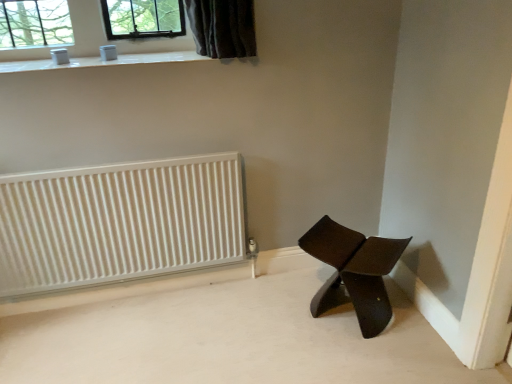
Question: From the image's perspective, is white glossy window sill at upper center beneath white ribbed radiator at left?

Choices:
 (A) yes
 (B) no

Answer: (B)

Question: From the image's perspective, is white glossy window sill at upper center above white ribbed radiator at left?

Choices:
 (A) no
 (B) yes

Answer: (B)

Question: Could white ribbed radiator at left be considered to be inside white glossy window sill at upper center?

Choices:
 (A) no
 (B) yes

Answer: (A)

Question: Is white glossy window sill at upper center shorter than white ribbed radiator at left?

Choices:
 (A) no
 (B) yes

Answer: (B)

Question: Is white glossy window sill at upper center positioned beyond the bounds of white ribbed radiator at left?

Choices:
 (A) no
 (B) yes

Answer: (B)

Question: Is white glossy window sill at upper center spatially inside matte brown chair at lower right, or outside of it?

Choices:
 (A) outside
 (B) inside

Answer: (A)

Question: Considering the positions of white glossy window sill at upper center and matte brown chair at lower right in the image, is white glossy window sill at upper center bigger or smaller than matte brown chair at lower right?

Choices:
 (A) big
 (B) small

Answer: (B)

Question: Does point (41, 61) appear closer or farther from the camera than point (353, 284)?

Choices:
 (A) closer
 (B) farther

Answer: (B)

Question: From a real-world perspective, is white glossy window sill at upper center positioned above or below matte brown chair at lower right?

Choices:
 (A) below
 (B) above

Answer: (B)

Question: Is matte brown chair at lower right inside or outside of white ribbed radiator at left?

Choices:
 (A) inside
 (B) outside

Answer: (B)

Question: From a real-world perspective, is matte brown chair at lower right physically located above or below white ribbed radiator at left?

Choices:
 (A) above
 (B) below

Answer: (B)

Question: Based on their positions, is matte brown chair at lower right located to the left or right of white ribbed radiator at left?

Choices:
 (A) right
 (B) left

Answer: (A)

Question: Is matte brown chair at lower right in front of or behind white ribbed radiator at left in the image?

Choices:
 (A) behind
 (B) front

Answer: (B)

Question: In the image, is matte brown chair at lower right on the left side or the right side of white glossy window sill at upper center?

Choices:
 (A) left
 (B) right

Answer: (B)

Question: From the image's perspective, is matte brown chair at lower right located above or below white glossy window sill at upper center?

Choices:
 (A) below
 (B) above

Answer: (A)